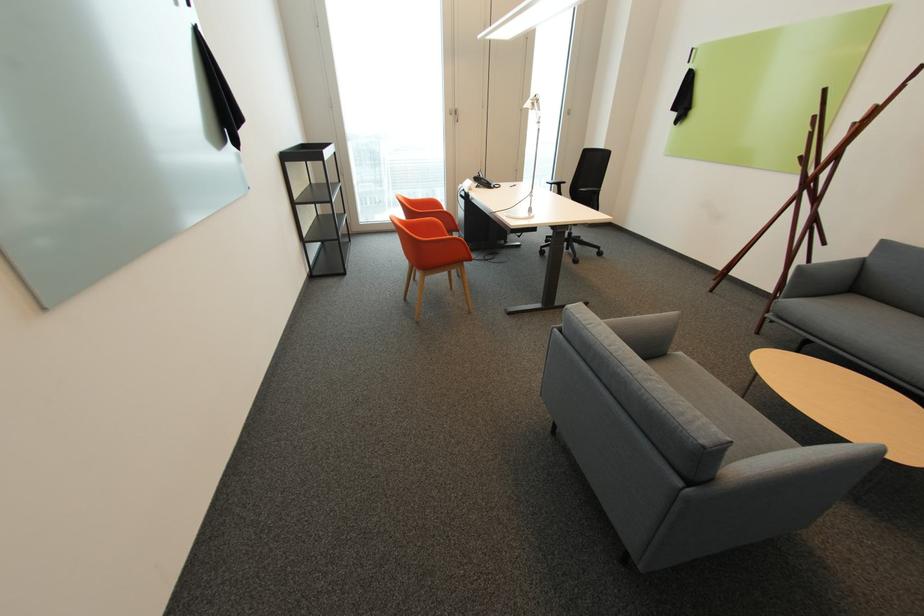
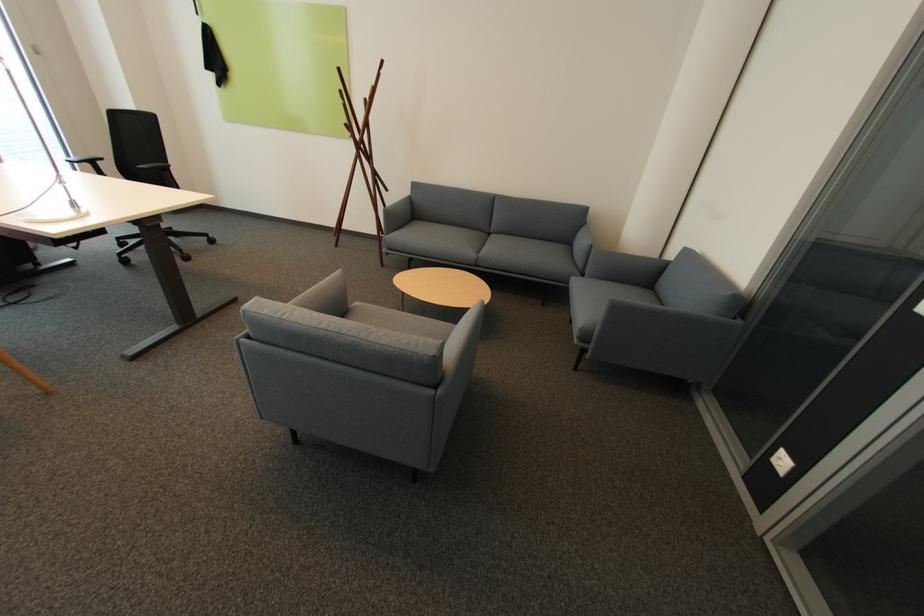
The first image is from the beginning of the video and the second image is from the end. How did the camera likely rotate when shooting the video?

The camera's rotation is toward right-down.